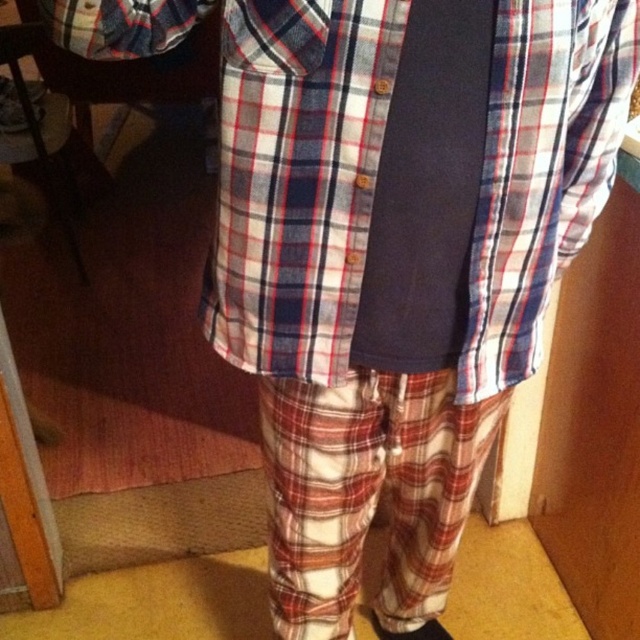
You are a fashion designer who needs to create a matching outfit. You have a plaid cotton shirt at center and a dark blue fabric tie at center. Can you place them close enough to each other so that they look coordinated? The minimum distance required for coordination is 3 inches.

The plaid cotton shirt at center and dark blue fabric tie at center are 3.20 inches apart from each other. Since 3.20 inches is greater than the minimum required 3 inches, they are close enough to look coordinated.

You are organizing a closet and need to place the plaid cotton shirt at center and the dark blue fabric tie at center on a hanger. Since the hanger has limited space, can you determine which item should be placed on the left side of the hanger to match their current positions?

The plaid cotton shirt at center should be placed on the left side of the hanger because it is already positioned to the left of the dark blue fabric tie at center in the image.